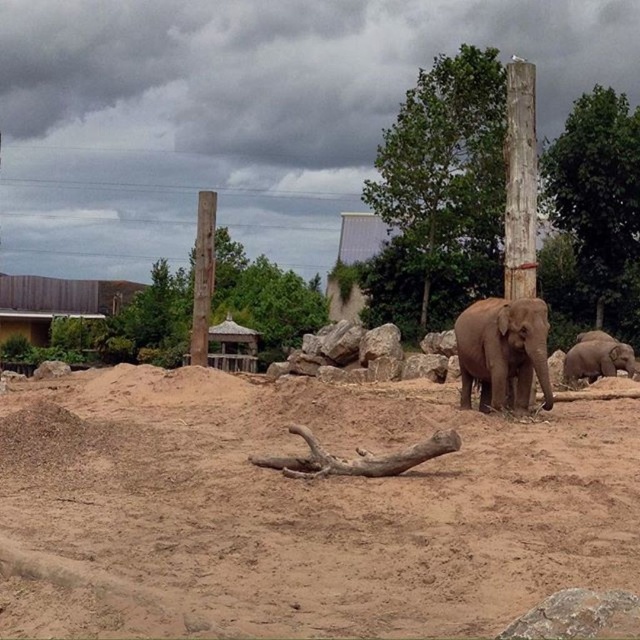
Question: Which point is closer to the camera taking this photo?

Choices:
 (A) (632, 188)
 (B) (442, 67)

Answer: (A)

Question: Which object is closer to the camera taking this photo?

Choices:
 (A) green leafy tree at center
 (B) weathered wood pole at right
 (C) green leafy tree at upper right
 (D) brown wood pole at left

Answer: (B)

Question: Does green leafy tree at upper center appear on the left side of brown wood pole at left?

Choices:
 (A) no
 (B) yes

Answer: (A)

Question: Which of the following is the farthest from the observer?

Choices:
 (A) weathered wood pole at right
 (B) gray matte elephant at center

Answer: (A)

Question: Is green leafy tree at upper right smaller than green leafy tree at center?

Choices:
 (A) no
 (B) yes

Answer: (A)

Question: Is green leafy tree at center smaller than weathered wood pole at right?

Choices:
 (A) no
 (B) yes

Answer: (B)